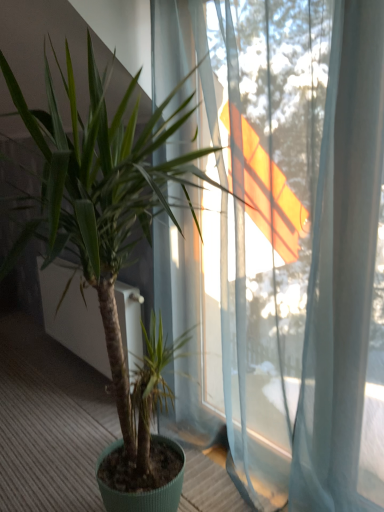
Image resolution: width=384 pixels, height=512 pixels. What do you see at coordinates (106, 209) in the screenshot?
I see `green matte plant at center` at bounding box center [106, 209].

Identify the location of green matte plant at center. (106, 209).

You are a GUI agent. You are given a task and a screenshot of the screen. Output one action in this format:
    pyautogui.click(x=<x>, y=<y>)
    Task: Click on the green matte plant at center
    This screenshot has width=384, height=512.
    Given the screenshot: What is the action you would take?
    pyautogui.click(x=106, y=209)